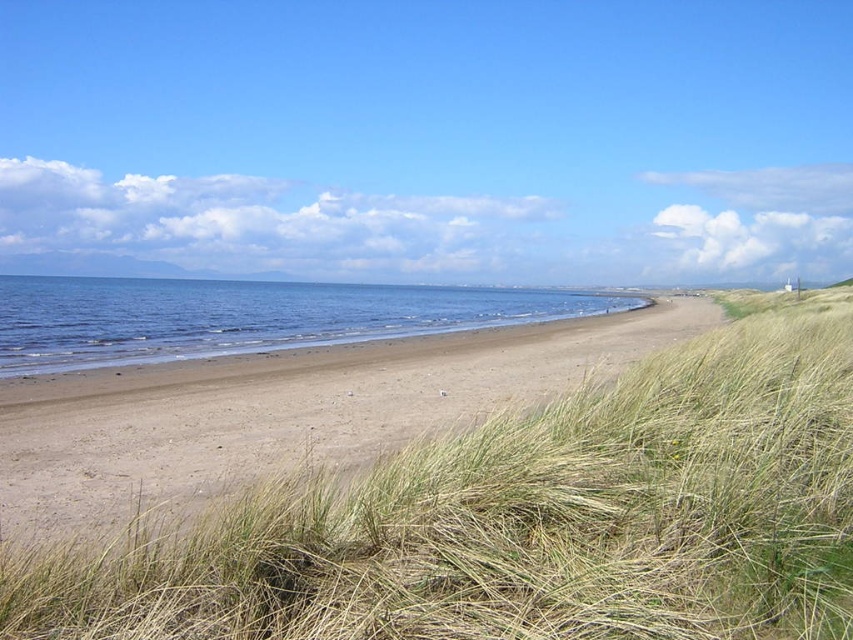
You are standing on the beach and want to walk from the dry grass at lower left to the blue water at center. Which direction should you head?

You should head upwards because the dry grass at lower left is located below the blue water at center, so moving upward from the dry grass at lower left will lead you toward the blue water at center.

You are standing on the beach and see the dry grass at lower left and the blue water at center. Which object is shorter in height?

The dry grass at lower left is shorter in height compared to the blue water at center.